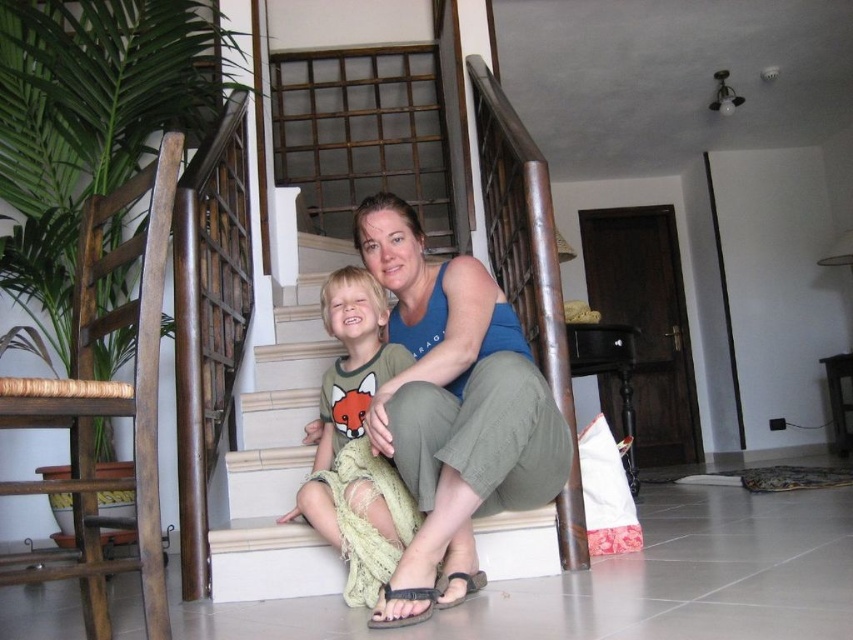
You are standing at the bottom of the white concrete stairs at center and want to pick up the brown leather sandal at lower center. Which direction should you move to reach it?

Since the white concrete stairs at center is further to the viewer than the brown leather sandal at lower center, you should move forward towards the sandal to reach it.

In the scene shown: You are standing at the bottom of the staircase and want to climb up to the next floor. Which direction should you move relative to the brown leather sandal at lower center to reach the white concrete stairs at center?

You should move to the left of the brown leather sandal at lower center to reach the white concrete stairs at center because the white concrete stairs at center are located to the left of the brown leather sandal at lower center.